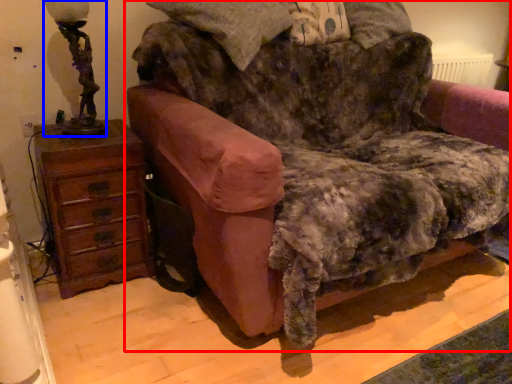
Question: Which object appears farthest to the camera in this image, furniture (highlighted by a red box) or table lamp (highlighted by a blue box)?

Choices:
 (A) furniture
 (B) table lamp

Answer: (B)